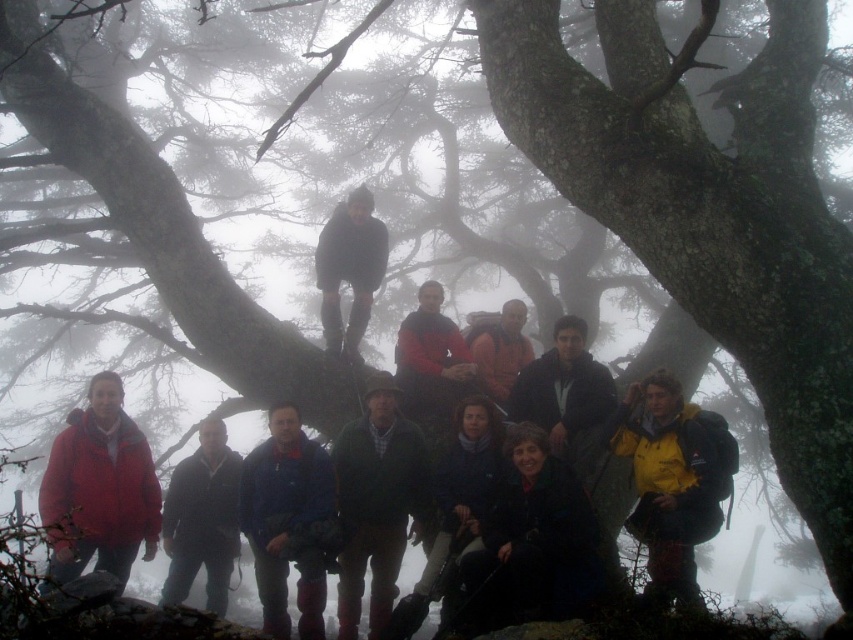
In the scene shown: You are standing at the center of the image and want to hand a map to the person wearing the dark blue jacket at lower center. In which direction should you move to reach them?

The dark blue jacket at lower center is located at point 0.853 on the x and 0.620 on the y coordinate. Since you are at the center, you need to move towards the lower right direction to reach them.